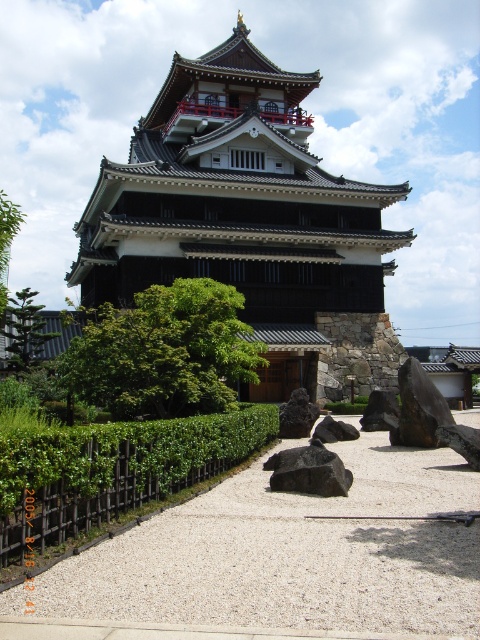
You are standing at the entrance of the traditional Japanese building and want to reach a specific point in the garden. From your current position, which of the two points, point (252, 176) or point (107, 499), is closer to you?

Point (107, 499) is closer to you because it is in front of point (252, 176) according to the spatial arrangement.

You are a visitor walking on the gravel pathway and want to take a photo of the green leafy tree at center and the black smooth rock at center. Which object should you move closer to in order to frame both in the same shot?

Since the green leafy tree at center might be wider than the black smooth rock at center, you should move closer to the tree to ensure both objects fit within the frame.

You are standing on the gravel pathway in front of the traditional Japanese building. You want to walk from the wooden fence to the tree. Which object will you pass first? The green leafy hedge at center or the green leafy tree at left?

The green leafy hedge at center is closer to the viewer than the green leafy tree at left, so you will pass the green leafy hedge at center first.